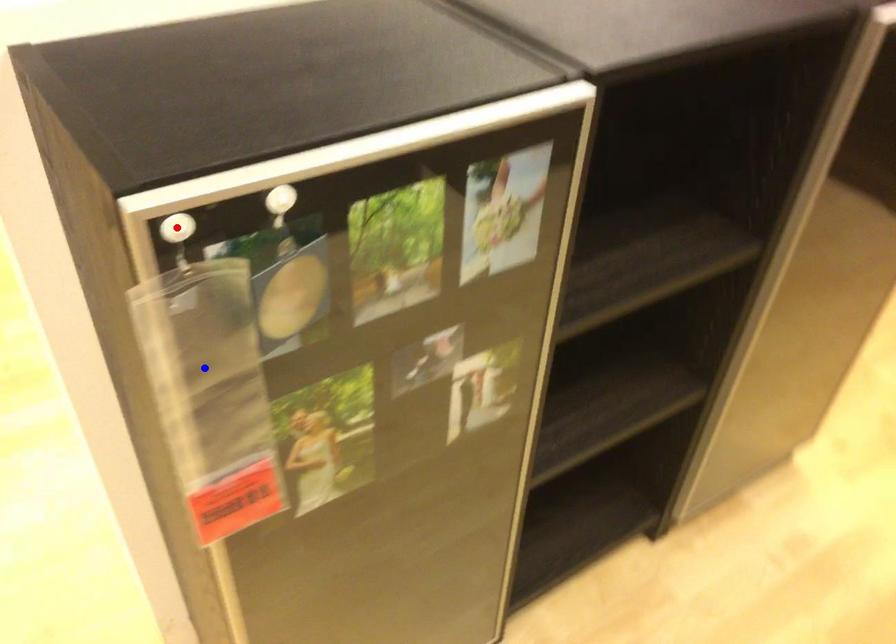
Question: Two points are marked on the image. Which point is closer to the camera?

Choices:
 (A) Blue point is closer.
 (B) Red point is closer.

Answer: (B)